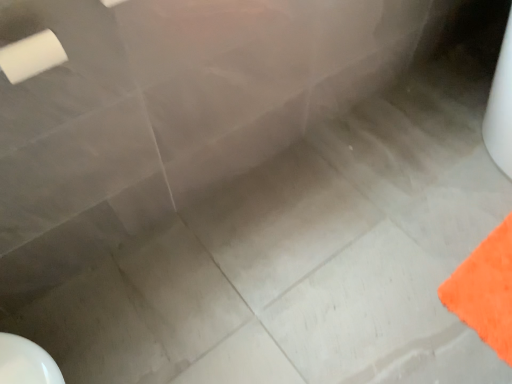
What do you see at coordinates (485, 290) in the screenshot? Image resolution: width=512 pixels, height=384 pixels. I see `orange fuzzy bath mat at lower right` at bounding box center [485, 290].

This screenshot has height=384, width=512. Find the location of `orange fuzzy bath mat at lower right`. orange fuzzy bath mat at lower right is located at coordinates (485, 290).

What is the approximate height of orange fuzzy bath mat at lower right?

orange fuzzy bath mat at lower right is 0.54 inches in height.

Identify the location of orange fuzzy bath mat at lower right. (485, 290).